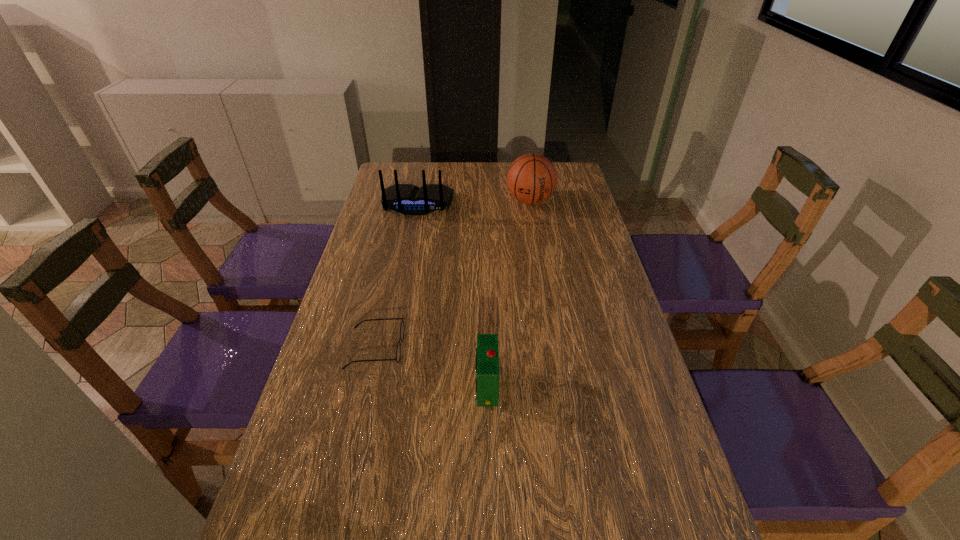
Where is `basketball`? This screenshot has width=960, height=540. basketball is located at coordinates (532, 178).

This screenshot has width=960, height=540. What are the coordinates of `router` in the screenshot? It's located at (407, 199).

Locate an element on the screen. This screenshot has height=540, width=960. alarm clock is located at coordinates (487, 353).

Identify the location of the third tallest object. The image size is (960, 540). (487, 353).

Find the location of `the shortest object`. the shortest object is located at coordinates (398, 351).

Find the location of a particular element. vacant space located 0.330m on the surface of the rightmost object near the brand logo is located at coordinates (541, 274).

Find the location of `vacant space situated 0.110m on the back of the router`. vacant space situated 0.110m on the back of the router is located at coordinates (411, 236).

Where is `vacant space situated on the front-facing side of the second object from right to left`? The image size is (960, 540). vacant space situated on the front-facing side of the second object from right to left is located at coordinates (433, 386).

Image resolution: width=960 pixels, height=540 pixels. Find the location of `vacant area located on the front-facing side of the second object from right to left`. vacant area located on the front-facing side of the second object from right to left is located at coordinates (438, 386).

The image size is (960, 540). Find the location of `free space located 0.100m on the front-facing side of the second object from right to left`. free space located 0.100m on the front-facing side of the second object from right to left is located at coordinates (433, 386).